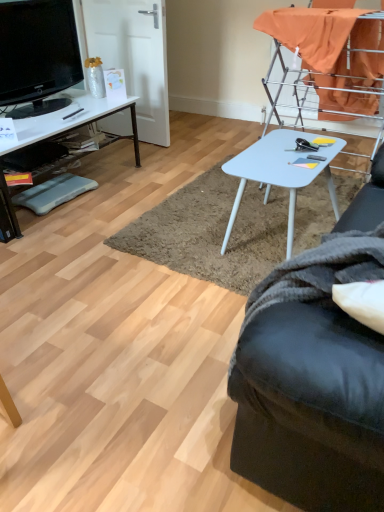
Find the location of a particular element. Image resolution: width=384 pixels, height=512 pixels. blank space above blue foam footrest at lower left (from a real-world perspective) is located at coordinates (50, 190).